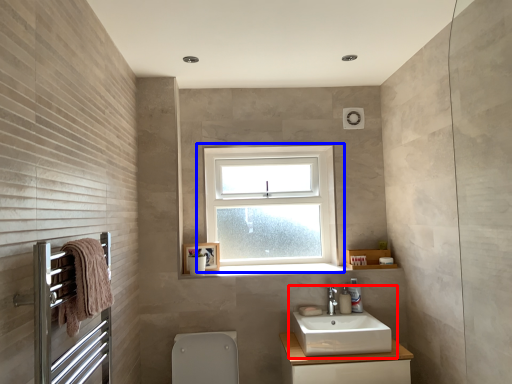
Question: Which object appears closest to the camera in this image, sink (highlighted by a red box) or window (highlighted by a blue box)?

Choices:
 (A) sink
 (B) window

Answer: (A)